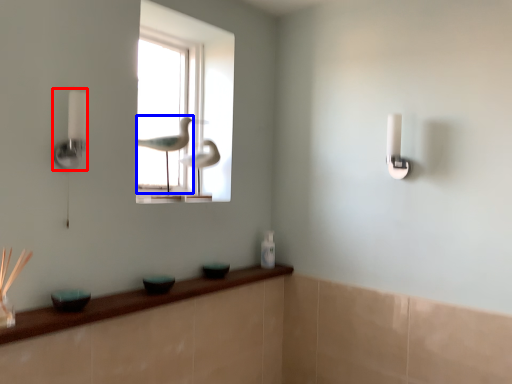
Question: Among these objects, which one is nearest to the camera, lamp (highlighted by a red box) or bird (highlighted by a blue box)?

Choices:
 (A) lamp
 (B) bird

Answer: (A)